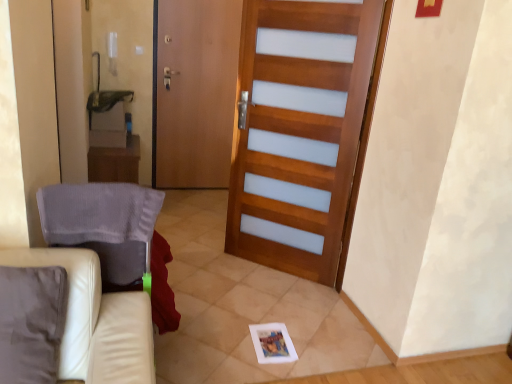
Question: Should I look upward or downward to see wooden screen door at center?

Choices:
 (A) down
 (B) up

Answer: (B)

Question: Does gray fabric armchair at left lie behind wooden barn door at center?

Choices:
 (A) yes
 (B) no

Answer: (B)

Question: Is gray fabric armchair at left smaller than wooden barn door at center?

Choices:
 (A) yes
 (B) no

Answer: (A)

Question: Is gray fabric armchair at left far away from wooden barn door at center?

Choices:
 (A) yes
 (B) no

Answer: (A)

Question: Is gray fabric armchair at left to the left of wooden barn door at center from the viewer's perspective?

Choices:
 (A) no
 (B) yes

Answer: (B)

Question: Is gray fabric armchair at left taller than wooden barn door at center?

Choices:
 (A) yes
 (B) no

Answer: (B)

Question: From a real-world perspective, is gray fabric armchair at left located higher than wooden barn door at center?

Choices:
 (A) no
 (B) yes

Answer: (A)

Question: Is wooden table at left closer to camera compared to wooden barn door at center?

Choices:
 (A) no
 (B) yes

Answer: (A)

Question: Does wooden table at left come behind wooden barn door at center?

Choices:
 (A) yes
 (B) no

Answer: (A)

Question: From a real-world perspective, is wooden table at left physically above wooden barn door at center?

Choices:
 (A) no
 (B) yes

Answer: (A)

Question: Are wooden table at left and wooden barn door at center located far from each other?

Choices:
 (A) yes
 (B) no

Answer: (A)

Question: Considering the relative sizes of wooden table at left and wooden barn door at center in the image provided, is wooden table at left thinner than wooden barn door at center?

Choices:
 (A) no
 (B) yes

Answer: (A)

Question: Is wooden barn door at center at the back of wooden table at left?

Choices:
 (A) yes
 (B) no

Answer: (B)

Question: Is white leather couch at lower left taller than wooden screen door at center?

Choices:
 (A) no
 (B) yes

Answer: (A)